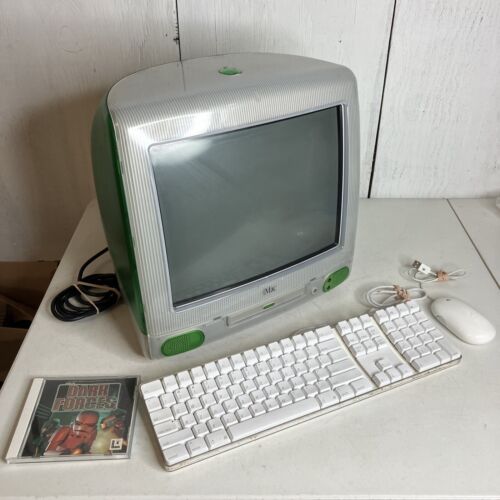
Where is `cd port`? The image size is (500, 500). cd port is located at coordinates (267, 305).